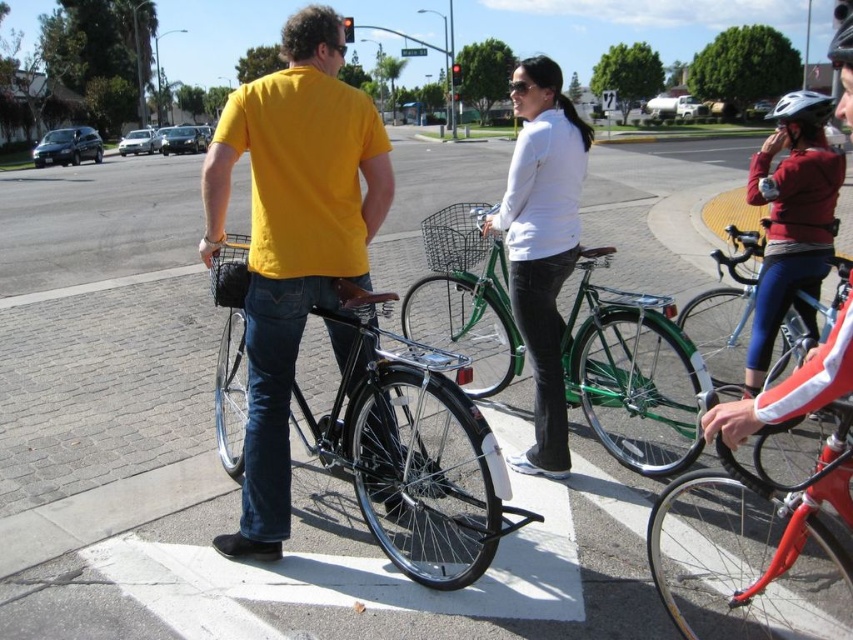
Can you confirm if shiny red bicycle at right is wider than black matte helmet at upper right?

In fact, shiny red bicycle at right might be narrower than black matte helmet at upper right.

The width and height of the screenshot is (853, 640). What do you see at coordinates (726, 310) in the screenshot?
I see `shiny red bicycle at right` at bounding box center [726, 310].

Find the location of a particular element. Image resolution: width=853 pixels, height=640 pixels. shiny red bicycle at right is located at coordinates (726, 310).

Can you confirm if matte yellow t-shirt at center is positioned above green metallic bicycle at center?

Yes.

Consider the image. Between matte yellow t-shirt at center and green metallic bicycle at center, which one appears on the left side from the viewer's perspective?

Positioned to the left is matte yellow t-shirt at center.

I want to click on matte yellow t-shirt at center, so click(292, 237).

Does point (286, 316) come behind point (544, 192)?

No, it is not.

Which of these two, matte yellow t-shirt at center or white matte jacket at center, stands taller?

With more height is matte yellow t-shirt at center.

Find the location of `matte yellow t-shirt at center`. matte yellow t-shirt at center is located at coordinates (292, 237).

Where is `matte yellow t-shirt at center`? The image size is (853, 640). matte yellow t-shirt at center is located at coordinates tap(292, 237).